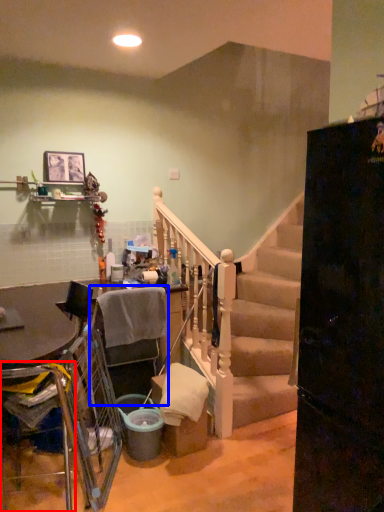
Question: Which object is closer to the camera taking this photo, armchair (highlighted by a red box) or armchair (highlighted by a blue box)?

Choices:
 (A) armchair
 (B) armchair

Answer: (A)